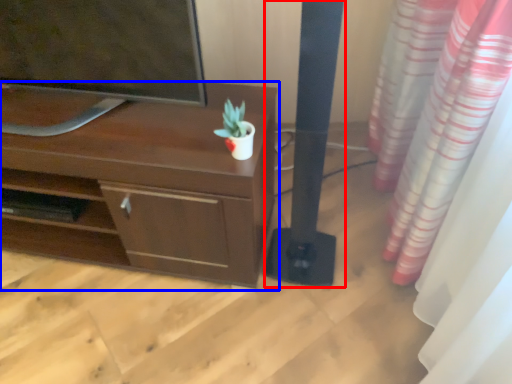
Question: Which object appears closest to the camera in this image, pillar (highlighted by a red box) or desk (highlighted by a blue box)?

Choices:
 (A) pillar
 (B) desk

Answer: (A)